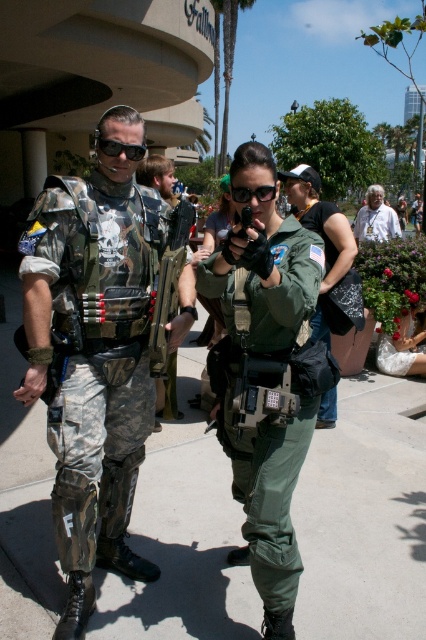
Which is in front, point (69, 596) or point (141, 154)?

Point (141, 154) is in front.

Which is more to the right, camouflage fabric armor at left or matte black goggles at left?

Positioned to the right is camouflage fabric armor at left.

Image resolution: width=426 pixels, height=640 pixels. Describe the element at coordinates (92, 362) in the screenshot. I see `camouflage fabric armor at left` at that location.

Locate an element on the screen. The width and height of the screenshot is (426, 640). camouflage fabric armor at left is located at coordinates (92, 362).

Based on the photo, does green matte uniform at center appear under green matte goggles at center?

Yes, green matte uniform at center is below green matte goggles at center.

Can you confirm if green matte uniform at center is positioned above green matte goggles at center?

No, green matte uniform at center is not above green matte goggles at center.

Which is in front, point (313, 275) or point (250, 198)?

Point (313, 275) is more forward.

The image size is (426, 640). In order to click on green matte uniform at center in this screenshot , I will do `click(273, 508)`.

Between green matte uniform at center and green fabric uniform at center, which one is positioned lower?

green matte uniform at center is below.

Based on the photo, does green matte uniform at center lie in front of green fabric uniform at center?

Yes, it is.

This screenshot has width=426, height=640. Describe the element at coordinates (273, 508) in the screenshot. I see `green matte uniform at center` at that location.

The width and height of the screenshot is (426, 640). What are the coordinates of `green matte uniform at center` in the screenshot? It's located at (273, 508).